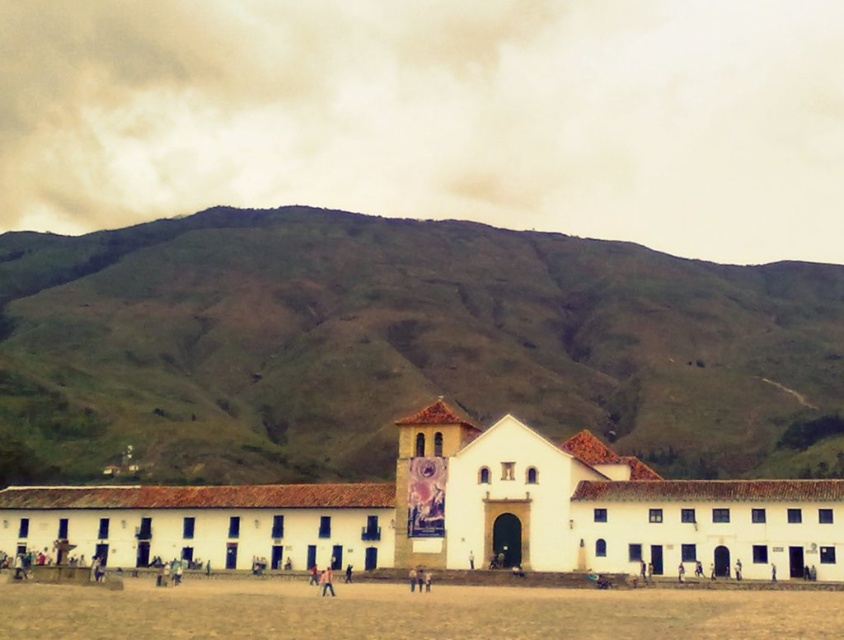
Question: Which object is the farthest from the light brown leather jacket at center?

Choices:
 (A) brown sandy dirt field at lower center
 (B) green grassy hill at upper center
 (C) white matte building at center

Answer: (B)

Question: Considering the relative positions of green grassy hill at upper center and light brown leather jacket at center in the image provided, where is green grassy hill at upper center located with respect to light brown leather jacket at center?

Choices:
 (A) right
 (B) left

Answer: (B)

Question: Is white matte building at center further to camera compared to brown sandy dirt field at lower center?

Choices:
 (A) yes
 (B) no

Answer: (A)

Question: Which point is closer to the camera?

Choices:
 (A) (295, 532)
 (B) (326, 616)
 (C) (323, 573)

Answer: (B)

Question: Does brown sandy dirt field at lower center appear on the left side of light brown leather jacket at center?

Choices:
 (A) yes
 (B) no

Answer: (B)

Question: Among these points, which one is farthest from the camera?

Choices:
 (A) (345, 609)
 (B) (659, 552)
 (C) (331, 593)

Answer: (B)